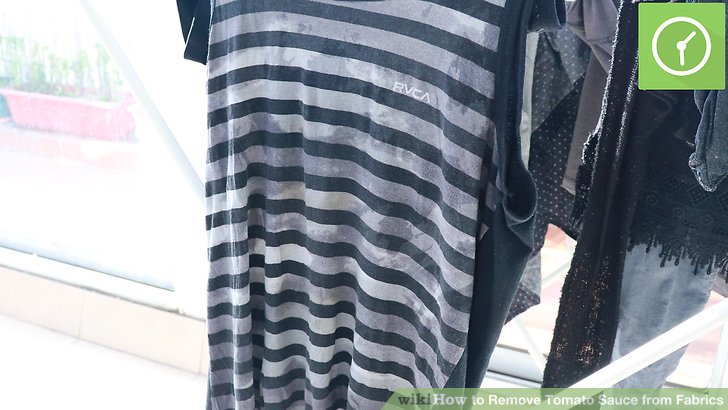
You are a GUI agent. You are given a task and a screenshot of the screen. Output one action in this format:
    pyautogui.click(x=<x>, y=<y>)
    Task: Click on the potted plant
    This screenshot has width=728, height=410.
    Given the screenshot: What is the action you would take?
    pyautogui.click(x=59, y=112)